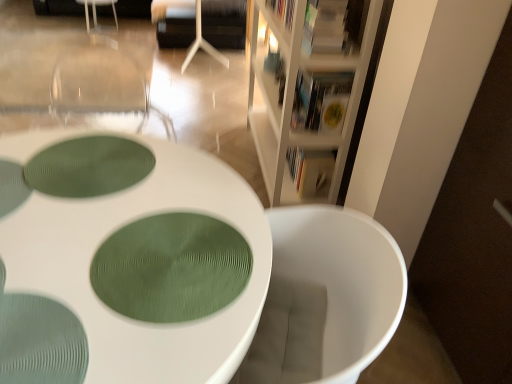
The image size is (512, 384). I want to click on vacant region under green textured oval at center, which ranks as the second oval in top-to-bottom order (from a real-world perspective), so click(x=147, y=259).